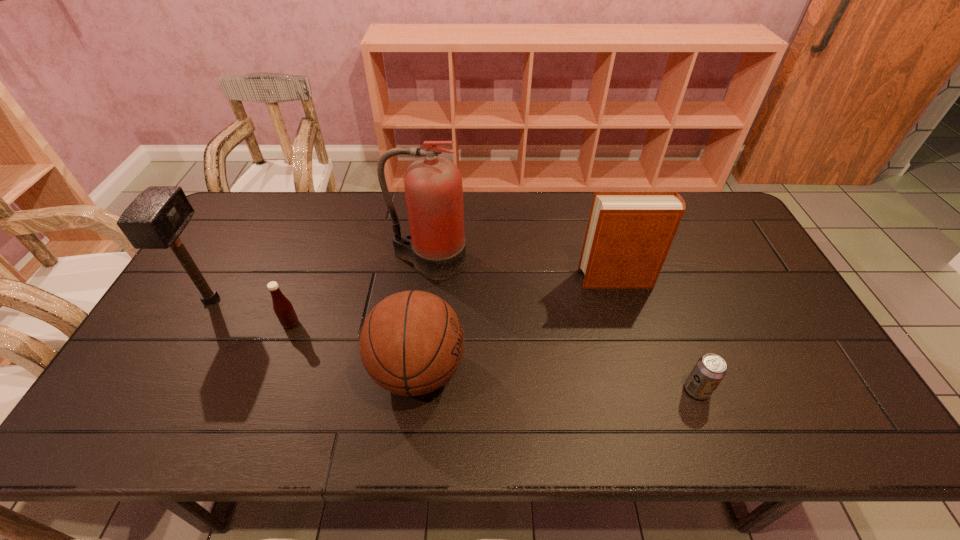
I want to click on the tallest object, so click(x=436, y=247).

You are a GUI agent. You are given a task and a screenshot of the screen. Output one action in this format:
    pyautogui.click(x=<x>, y=<y>)
    Task: Click on the leftmost object
    
    Given the screenshot: What is the action you would take?
    pyautogui.click(x=155, y=219)

The height and width of the screenshot is (540, 960). I want to click on mallet, so click(x=155, y=219).

The image size is (960, 540). I want to click on hardback book, so click(x=629, y=233).

You are a GUI agent. You are given a task and a screenshot of the screen. Output one action in this format:
    pyautogui.click(x=<x>, y=<y>)
    Task: Click on the fourth tallest object
    Image resolution: width=960 pixels, height=540 pixels.
    Given the screenshot: What is the action you would take?
    pyautogui.click(x=412, y=342)

Find the location of a particular element. Tabasco sauce is located at coordinates (282, 307).

At what (x,y) coordinates should I click in order to perform the action: click on the fifth object from right to left. Please return your answer as a coordinate pair (x, y). The image size is (960, 540). Looking at the image, I should click on (282, 307).

Image resolution: width=960 pixels, height=540 pixels. In order to click on beer can in this screenshot , I will do `click(710, 369)`.

The width and height of the screenshot is (960, 540). I want to click on free region located at the nozzle of the tallest object, so click(x=420, y=335).

I want to click on free space located on the right of the fifth shortest object, so click(273, 300).